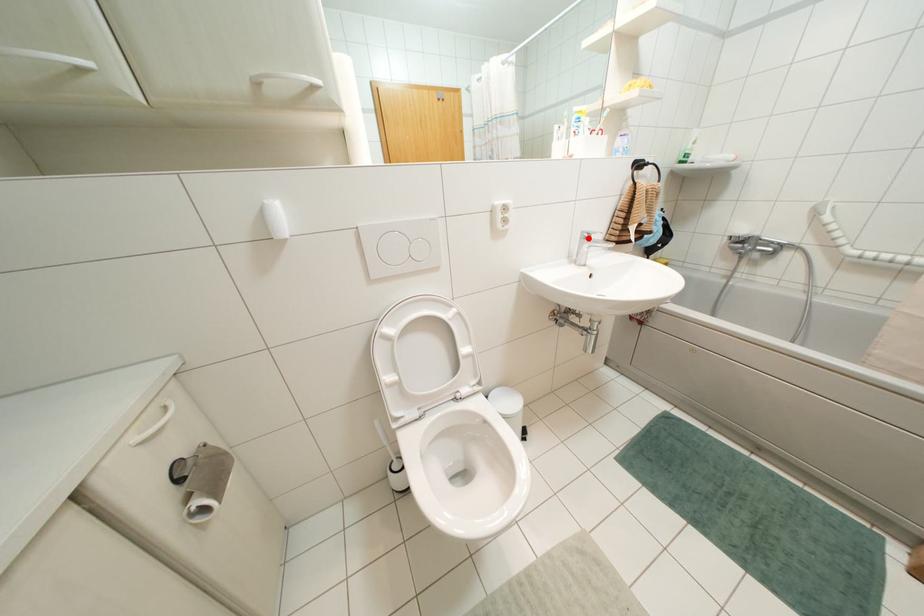
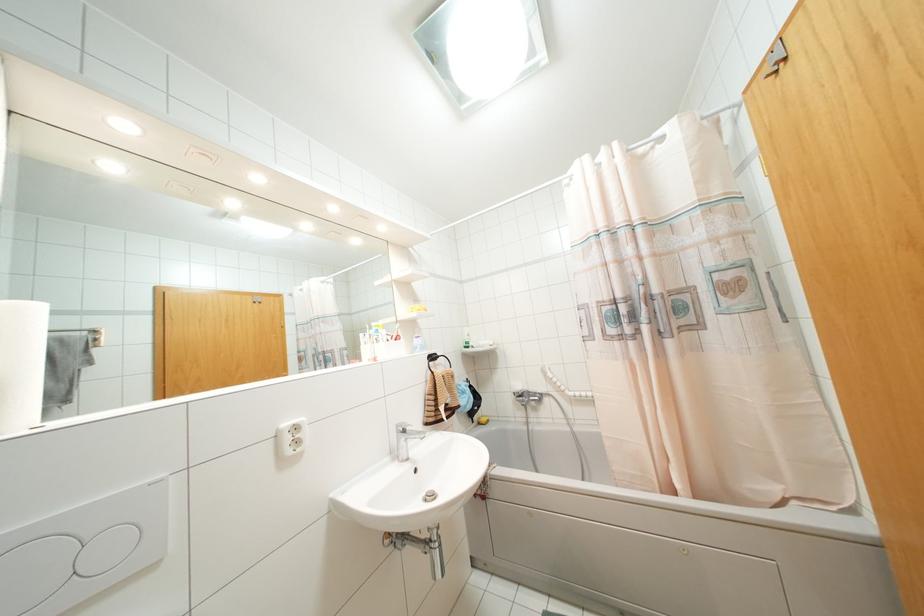
Question: I am providing you with two images of the same scene from different viewpoints. A red point is shown in image1. For the corresponding object point in image2, is it positioned nearer or farther from the camera?

Choices:
 (A) Nearer
 (B) Farther

Answer: (B)